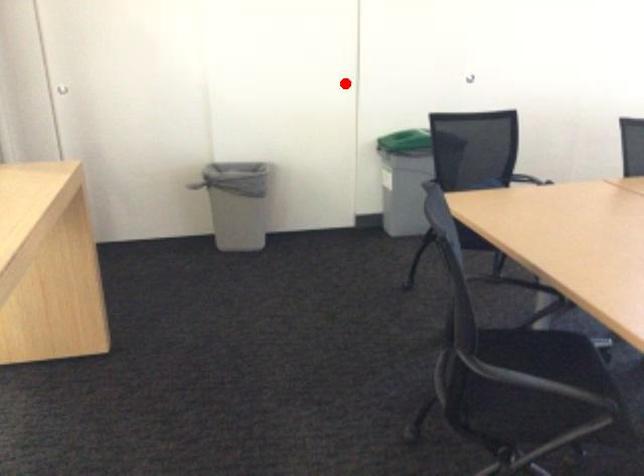
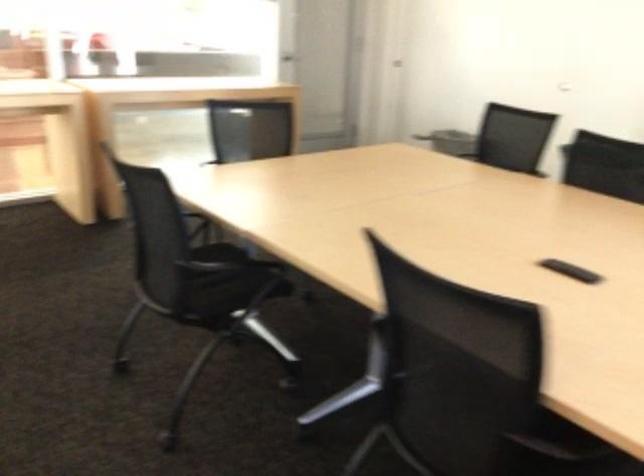
Question: I am providing you with two images of the same scene from different viewpoints. A red point is marked on the first image. Is the red point's position out of view in image 2?

Choices:
 (A) Yes
 (B) No

Answer: (A)